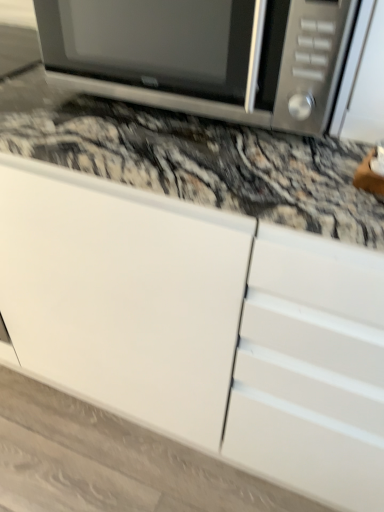
This screenshot has width=384, height=512. What do you see at coordinates (201, 326) in the screenshot?
I see `white matte cabinet at upper center` at bounding box center [201, 326].

This screenshot has width=384, height=512. What are the coordinates of `white matte cabinet at upper center` in the screenshot? It's located at (201, 326).

Measure the distance between white matte cabinet at upper center and camera.

55.19 centimeters.

What do you see at coordinates (205, 55) in the screenshot? This screenshot has width=384, height=512. I see `satin silver microwave at upper center` at bounding box center [205, 55].

Locate an element on the screen. The image size is (384, 512). satin silver microwave at upper center is located at coordinates (205, 55).

Where is `white matte cabinet at upper center`? white matte cabinet at upper center is located at coordinates (201, 326).

Is satin silver microwave at upper center to the left or to the right of white matte cabinet at upper center in the image?

In the image, satin silver microwave at upper center appears on the right side of white matte cabinet at upper center.

Which object is more forward, satin silver microwave at upper center or white matte cabinet at upper center?

white matte cabinet at upper center is more forward.

Based on the photo, which is less distant, (352, 21) or (75, 196)?

Point (352, 21) is positioned closer to the camera compared to point (75, 196).

From the image's perspective, relative to white matte cabinet at upper center, is satin silver microwave at upper center above or below?

From the image's perspective, satin silver microwave at upper center appears above white matte cabinet at upper center.

From a real-world perspective, is satin silver microwave at upper center positioned above or below white matte cabinet at upper center?

satin silver microwave at upper center is above white matte cabinet at upper center.

Is satin silver microwave at upper center wider or thinner than white matte cabinet at upper center?

Considering their sizes, satin silver microwave at upper center looks slimmer than white matte cabinet at upper center.

In terms of height, does satin silver microwave at upper center look taller or shorter compared to white matte cabinet at upper center?

Clearly, satin silver microwave at upper center is shorter compared to white matte cabinet at upper center.

Between satin silver microwave at upper center and white matte cabinet at upper center, which one has smaller size?

With smaller size is satin silver microwave at upper center.

Is satin silver microwave at upper center surrounding white matte cabinet at upper center?

Definitely not — white matte cabinet at upper center is not inside satin silver microwave at upper center.

Is satin silver microwave at upper center not close to white matte cabinet at upper center?

They are positioned close to each other.

Is satin silver microwave at upper center facing towards white matte cabinet at upper center?

No, satin silver microwave at upper center is not turned towards white matte cabinet at upper center.

Identify the location of cabinetry that appears in front of the satin silver microwave at upper center. The image size is (384, 512). (201, 326).

From the picture: Considering the positions of objects white matte cabinet at upper center and satin silver microwave at upper center in the image provided, who is more to the left, white matte cabinet at upper center or satin silver microwave at upper center?

white matte cabinet at upper center is more to the left.

Is white matte cabinet at upper center closer to the viewer compared to satin silver microwave at upper center?

Yes, the depth of white matte cabinet at upper center is less than that of satin silver microwave at upper center.

Which point is more distant from viewer, (381, 502) or (131, 5)?

The point (381, 502) is more distant.

From the image's perspective, would you say white matte cabinet at upper center is shown under satin silver microwave at upper center?

Yes.

From a real-world perspective, relative to satin silver microwave at upper center, is white matte cabinet at upper center vertically above or below?

From a real-world perspective, white matte cabinet at upper center is physically below satin silver microwave at upper center.

Considering the sizes of objects white matte cabinet at upper center and satin silver microwave at upper center in the image provided, who is thinner, white matte cabinet at upper center or satin silver microwave at upper center?

Thinner between the two is satin silver microwave at upper center.

From the picture: Is white matte cabinet at upper center shorter than satin silver microwave at upper center?

No, white matte cabinet at upper center is not shorter than satin silver microwave at upper center.

Looking at the image, does white matte cabinet at upper center seem bigger or smaller compared to satin silver microwave at upper center?

white matte cabinet at upper center is bigger than satin silver microwave at upper center.

Is white matte cabinet at upper center not within satin silver microwave at upper center?

Yes, white matte cabinet at upper center is outside of satin silver microwave at upper center.

Is white matte cabinet at upper center in contact with satin silver microwave at upper center?

No, white matte cabinet at upper center is not touching satin silver microwave at upper center.

Is white matte cabinet at upper center aimed at satin silver microwave at upper center?

No, white matte cabinet at upper center is not aimed at satin silver microwave at upper center.

How many degrees apart are the facing directions of white matte cabinet at upper center and satin silver microwave at upper center?

1.13 degrees separate the facing orientations of white matte cabinet at upper center and satin silver microwave at upper center.

Locate an element on the screen. This screenshot has height=512, width=384. microwave oven that appears above the white matte cabinet at upper center (from the image's perspective) is located at coordinates (205, 55).

The height and width of the screenshot is (512, 384). Find the location of `cabinetry that is below the satin silver microwave at upper center (from the image's perspective)`. cabinetry that is below the satin silver microwave at upper center (from the image's perspective) is located at coordinates (201, 326).

Where is `cabinetry below the satin silver microwave at upper center (from a real-world perspective)`? cabinetry below the satin silver microwave at upper center (from a real-world perspective) is located at coordinates (201, 326).